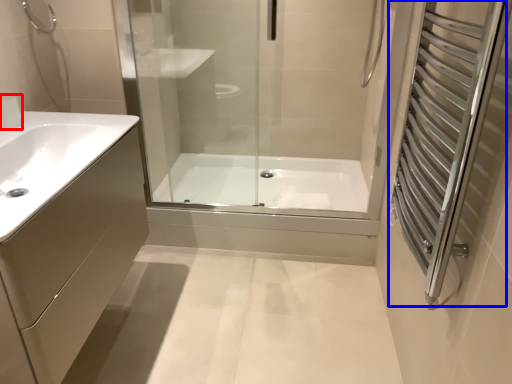
Question: Which object appears closest to the camera in this image, faucet (highlighted by a red box) or screen door (highlighted by a blue box)?

Choices:
 (A) faucet
 (B) screen door

Answer: (B)